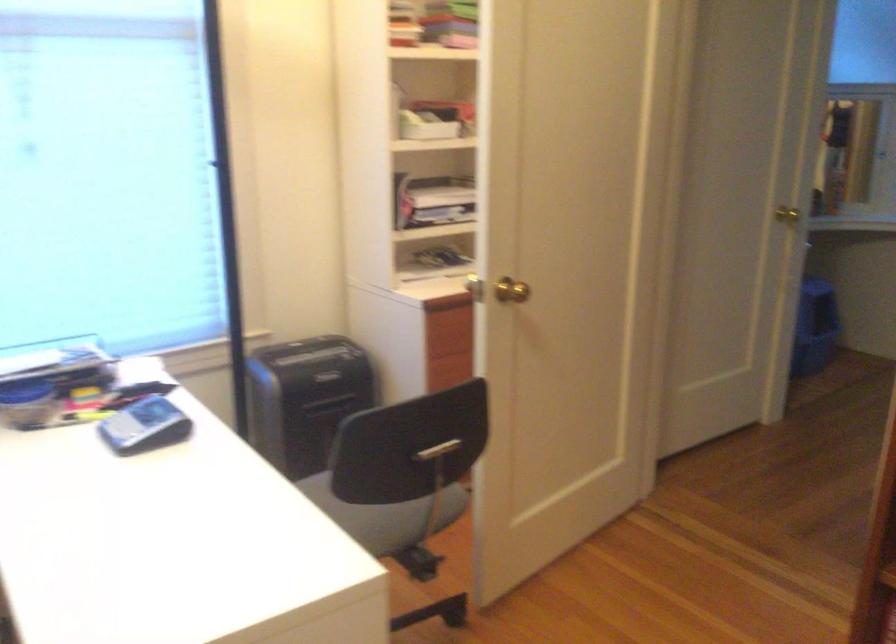
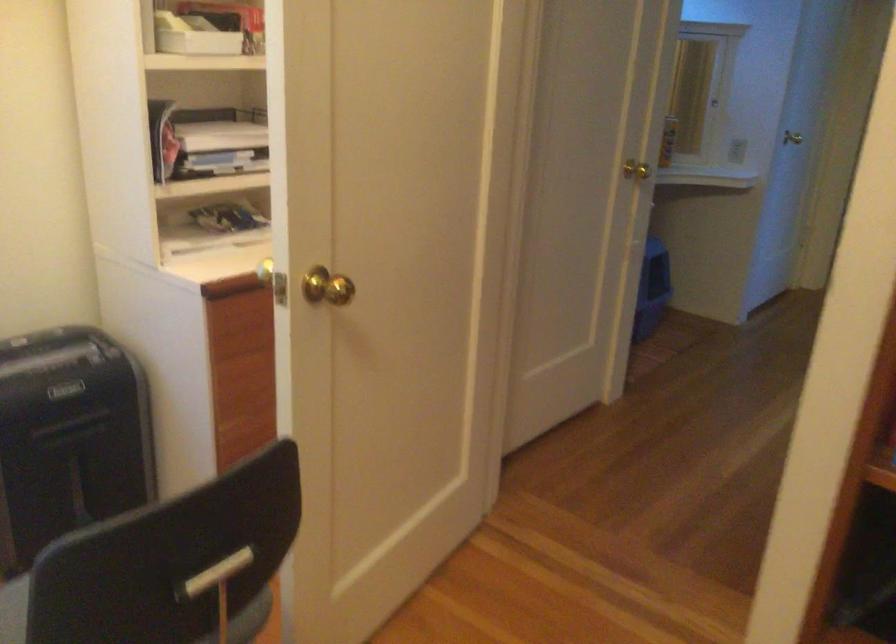
Question: What movement of the cameraman would produce the second image?

Choices:
 (A) Left
 (B) Right
 (C) Forward
 (D) Backward

Answer: (C)